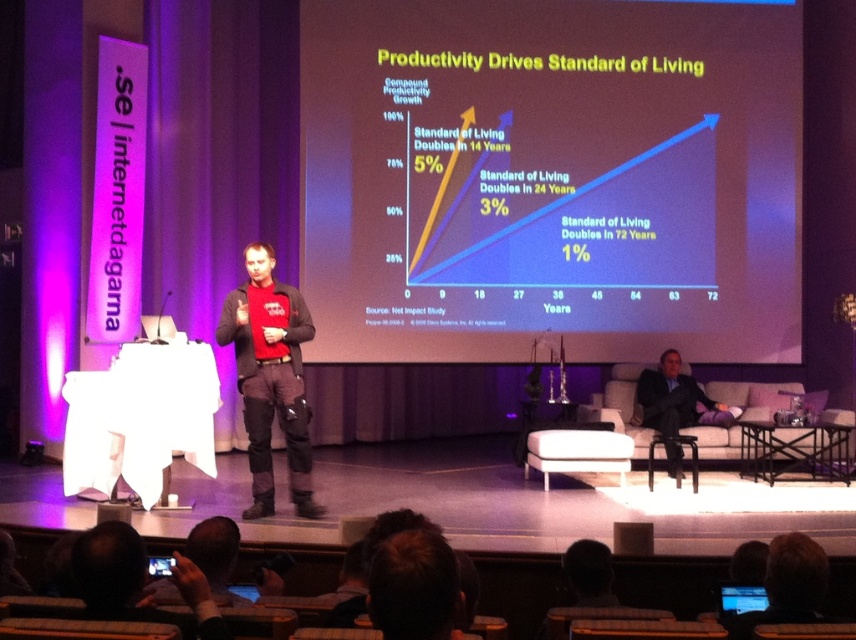
Does point (248, 458) lie in front of point (744, 596)?

That is False.

Which is behind, point (245, 298) or point (749, 595)?

Point (245, 298)

The image size is (856, 640). What do you see at coordinates (270, 378) in the screenshot? I see `matte red shirt at center` at bounding box center [270, 378].

Locate an element on the screen. Image resolution: width=856 pixels, height=640 pixels. matte red shirt at center is located at coordinates (270, 378).

What are the coordinates of `white matte projector screen at upper center` in the screenshot? It's located at (551, 177).

Is point (560, 252) positioned behind point (651, 380)?

That is True.

Between point (456, 301) and point (667, 436), which one is positioned in front?

Positioned in front is point (667, 436).

Identify the location of white matte projector screen at upper center. (551, 177).

Does white matte projector screen at upper center come in front of matte red shirt at center?

No, it is not.

You are a GUI agent. You are given a task and a screenshot of the screen. Output one action in this format:
    pyautogui.click(x=<x>, y=<y>)
    Task: Click on the white matte projector screen at upper center
    
    Given the screenshot: What is the action you would take?
    pyautogui.click(x=551, y=177)

The image size is (856, 640). In order to click on white matte projector screen at upper center in this screenshot , I will do `click(551, 177)`.